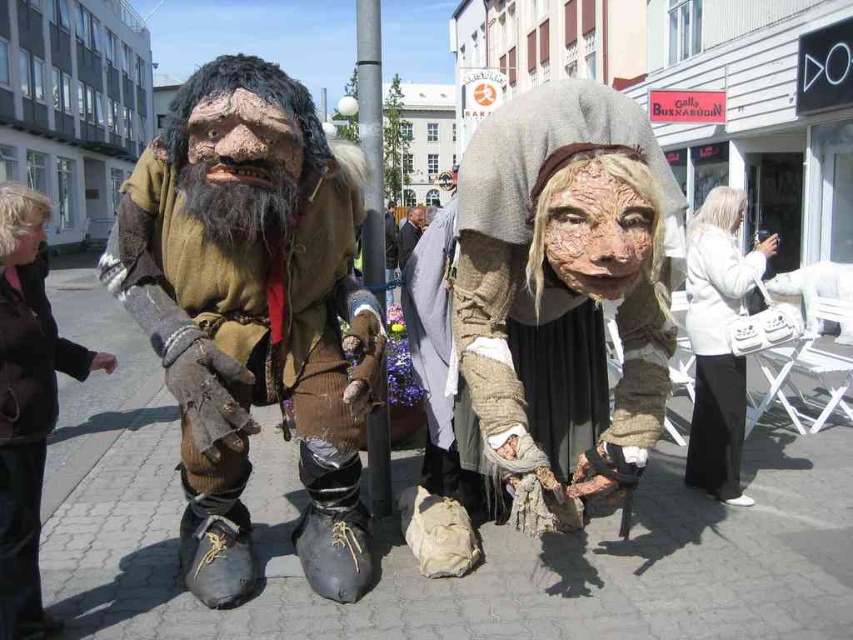
Question: Does matte gray fabric at center have a greater width compared to white leather handbag at lower right?

Choices:
 (A) no
 (B) yes

Answer: (B)

Question: Which point is farther to the camera?

Choices:
 (A) pyautogui.click(x=218, y=180)
 (B) pyautogui.click(x=384, y=499)
 (C) pyautogui.click(x=415, y=221)

Answer: (C)

Question: Which point is farther to the camera?

Choices:
 (A) (410, 218)
 (B) (49, 374)

Answer: (A)

Question: Can you confirm if matte brown fur coat at left is positioned above matte gray fabric at center?

Choices:
 (A) no
 (B) yes

Answer: (B)

Question: Is matte gray fabric at center to the left of white leather handbag at lower right from the viewer's perspective?

Choices:
 (A) no
 (B) yes

Answer: (B)

Question: Which point is closer to the camera?

Choices:
 (A) white leather handbag at lower right
 (B) matte brown fur coat at left
 (C) matte brown leather boots at lower left

Answer: (C)